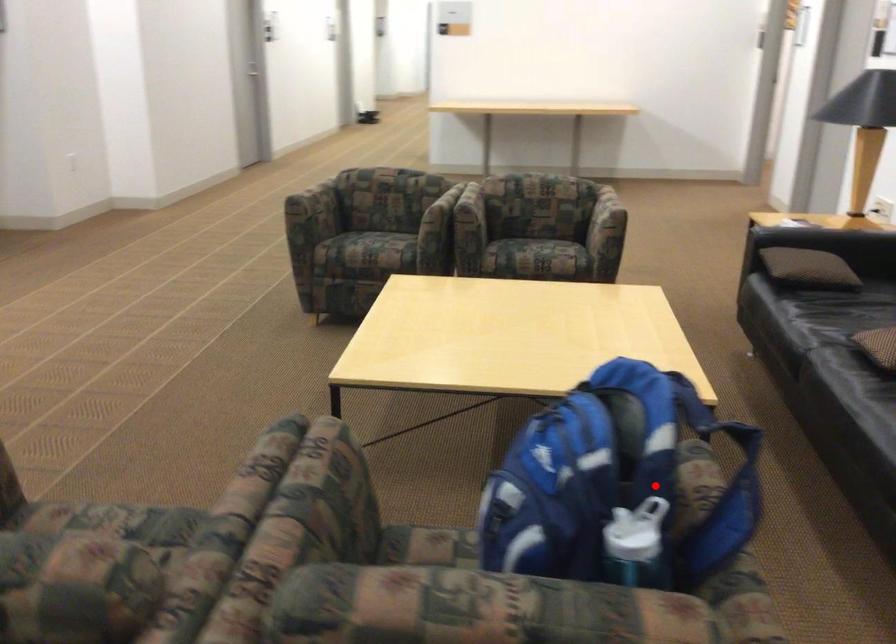
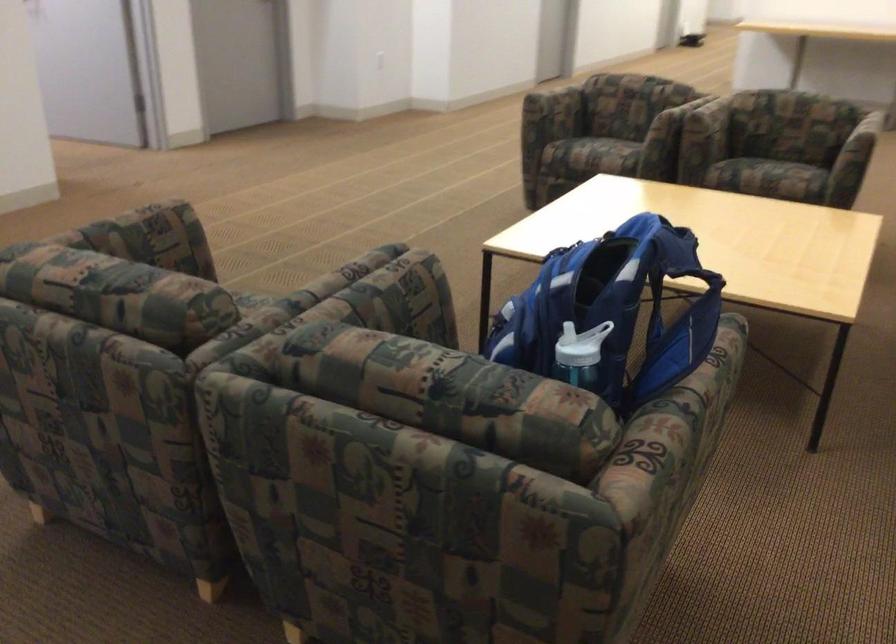
Question: I am providing you with two images of the same scene from different viewpoints. A red point is marked on the first image. Can you still see the location of the red point in image 2?

Choices:
 (A) Yes
 (B) No

Answer: (A)